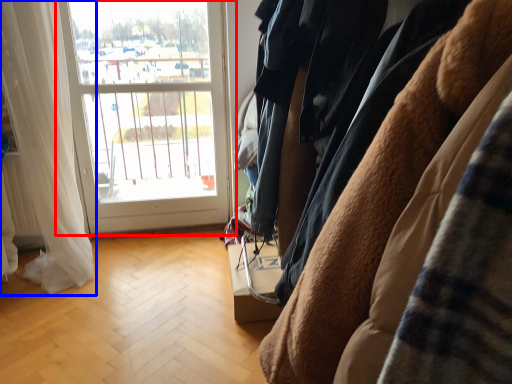
Question: Which object is further to the camera taking this photo, window (highlighted by a red box) or curtain (highlighted by a blue box)?

Choices:
 (A) window
 (B) curtain

Answer: (A)